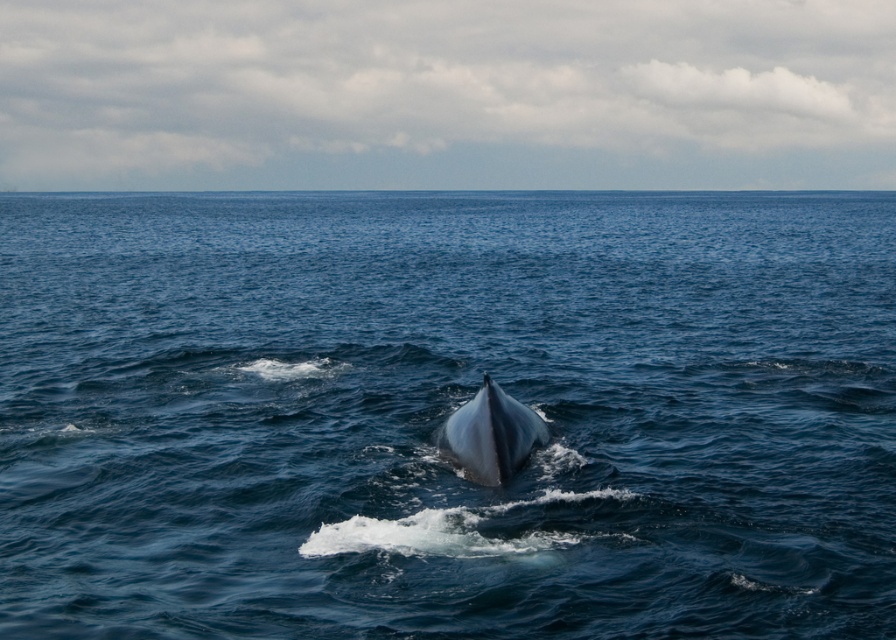
You are a marine biologist observing the ocean scene. You need to determine which object occupies more horizontal space in the image between the blue water at center and the gray smooth whale at center. Based on the scene description, which one is wider?

The blue water at center might be wider than gray smooth whale at center according to the description.

You are a marine biologist observing the ocean scene. You notice the blue water at center and the gray smooth whale at center. Which object is positioned higher in the image?

The blue water at center is located above the gray smooth whale at center, so the blue water at center is positioned higher in the image.